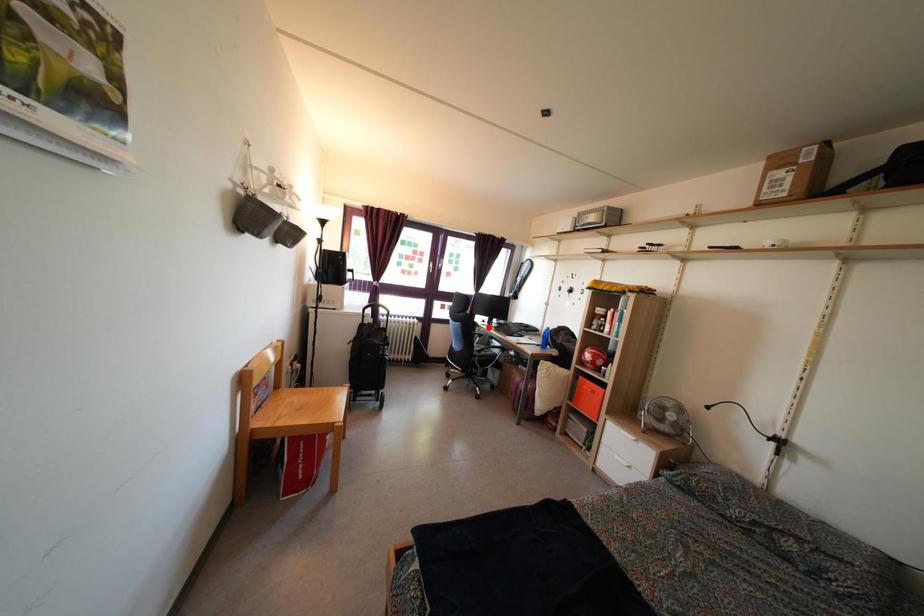
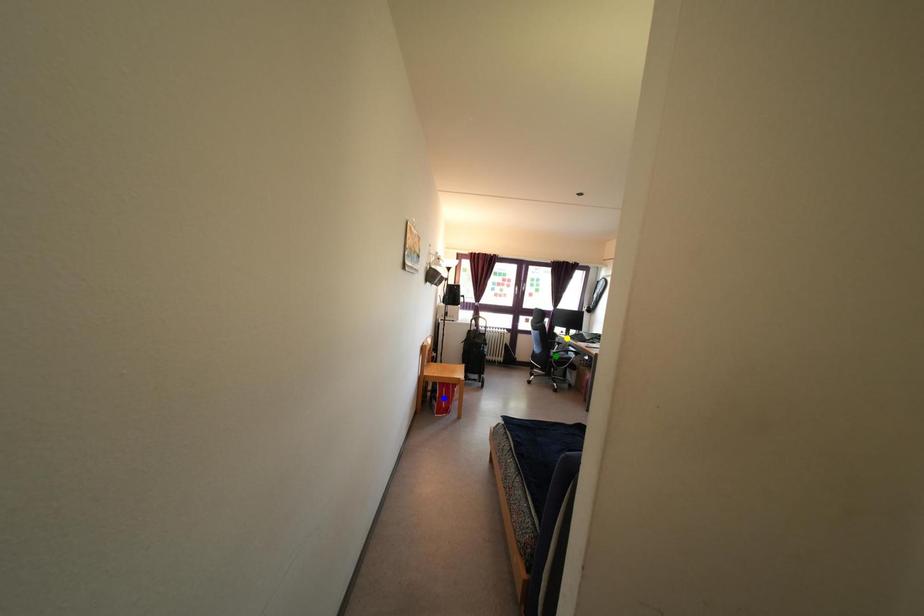
Question: I am providing you with two images of the same scene from different viewpoints. A red point is marked on the first image. You are given multiple points on the second image. Which mark in image 2 goes with the point in image 1?

Choices:
 (A) blue point
 (B) yellow point
 (C) green point

Answer: (B)